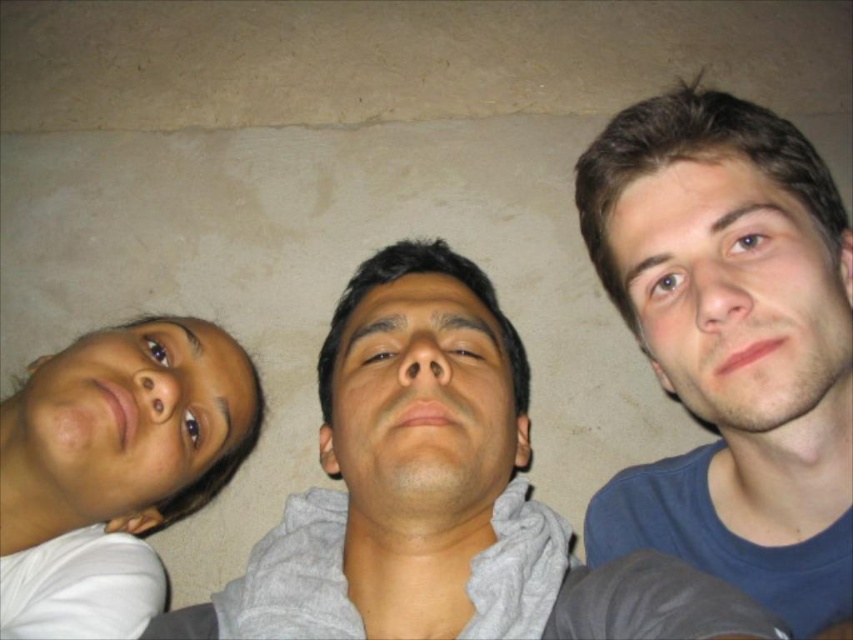
Question: Does gray matte hoodie at center appear on the right side of smooth skin face at right?

Choices:
 (A) yes
 (B) no

Answer: (B)

Question: Which of the following is the farthest from the observer?

Choices:
 (A) smooth skin face at right
 (B) gray matte hoodie at center
 (C) smooth skin face at center
 (D) blue cotton shirt at right

Answer: (C)

Question: Which of these objects is positioned farthest from the blue cotton shirt at right?

Choices:
 (A) smooth skin face at center
 (B) matte skin face at left

Answer: (B)

Question: Is blue cotton shirt at right to the left of matte skin face at left from the viewer's perspective?

Choices:
 (A) no
 (B) yes

Answer: (A)

Question: Is blue cotton shirt at right thinner than smooth skin face at center?

Choices:
 (A) no
 (B) yes

Answer: (A)

Question: Which point is closer to the camera?

Choices:
 (A) smooth skin face at center
 (B) matte skin face at left
 (C) gray matte hoodie at center
 (D) smooth skin face at right

Answer: (C)